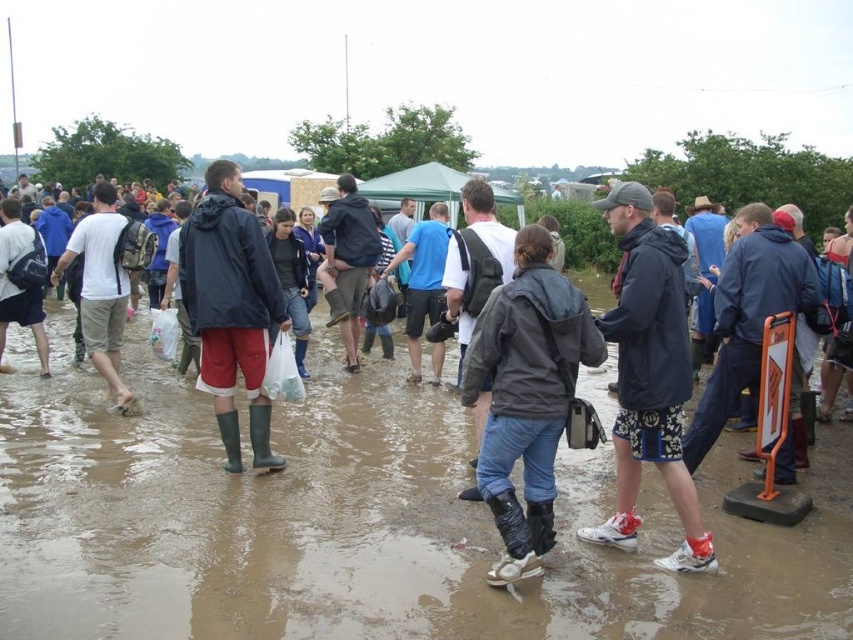
Question: Which point is closer to the camera?

Choices:
 (A) rubber boots at center
 (B) white matte t-shirt at left
 (C) brown muddy ground at center
 (D) matte black jacket at left

Answer: (C)

Question: Which point is farther to the camera?

Choices:
 (A) matte black jacket at left
 (B) rubber boots at center
 (C) dark blue waterproof jacket at center

Answer: (A)

Question: Which of the following is the closest to the observer?

Choices:
 (A) (64, 253)
 (B) (532, 454)
 (C) (204, 545)

Answer: (B)

Question: Observing the image, what is the correct spatial positioning of brown muddy ground at center in reference to rubber boots at center?

Choices:
 (A) above
 (B) below

Answer: (B)

Question: Is brown muddy ground at center positioned at the back of dark blue waterproof jacket at center?

Choices:
 (A) no
 (B) yes

Answer: (A)

Question: Does brown muddy ground at center appear under white matte t-shirt at left?

Choices:
 (A) no
 (B) yes

Answer: (B)